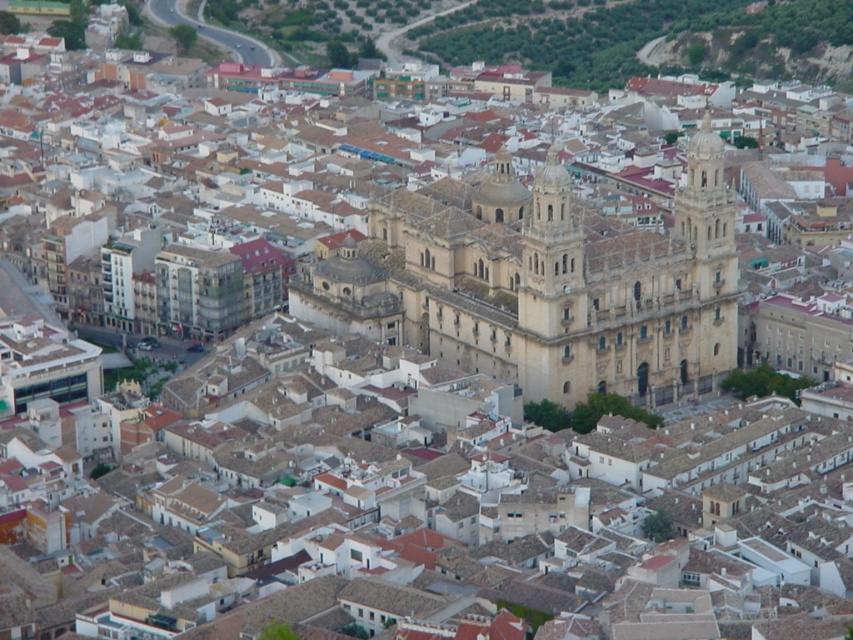
Question: Which object is closer to the camera taking this photo?

Choices:
 (A) light beige stone tower at center
 (B) beige stone tower at center

Answer: (A)

Question: Does light beige stone tower at center have a lesser width compared to beige stone tower at center?

Choices:
 (A) no
 (B) yes

Answer: (B)

Question: Can you confirm if light beige stone tower at center is positioned below beige stone tower at center?

Choices:
 (A) yes
 (B) no

Answer: (A)

Question: Is light beige stone tower at center thinner than beige stone tower at center?

Choices:
 (A) yes
 (B) no

Answer: (A)